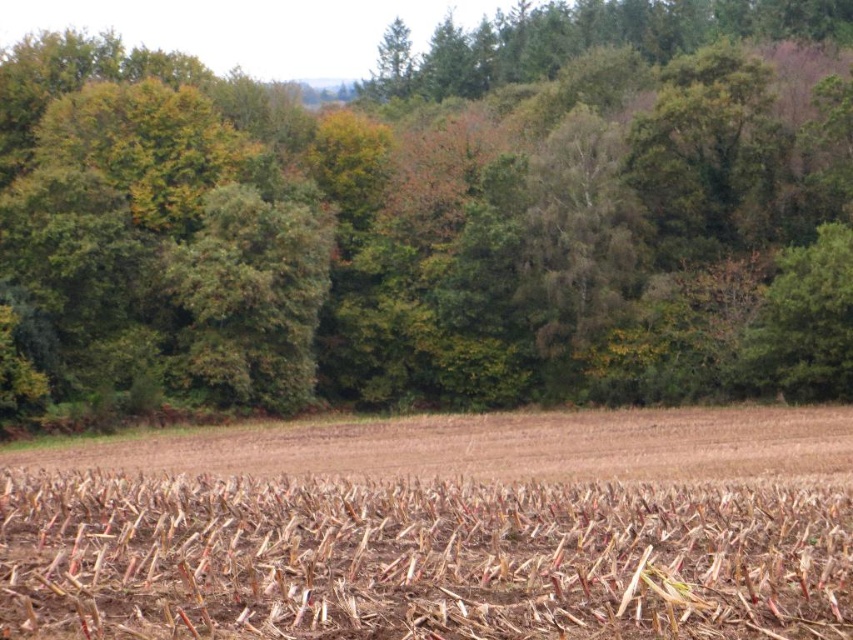
In the scene shown: You are a farmer planning to plant new crops in the field. You notice the green matte tree at center and the brown dry stalks at center. Which object takes up more space in the field?

The green matte tree at center has a larger size compared to brown dry stalks at center, so it takes up more space in the field.

You are a hiker who wants to cross the field to reach the forest. You see the green matte tree at center and the brown dry stalks at center. How far apart are these two landmarks?

The green matte tree at center and the brown dry stalks at center are 53.47 meters apart from each other.